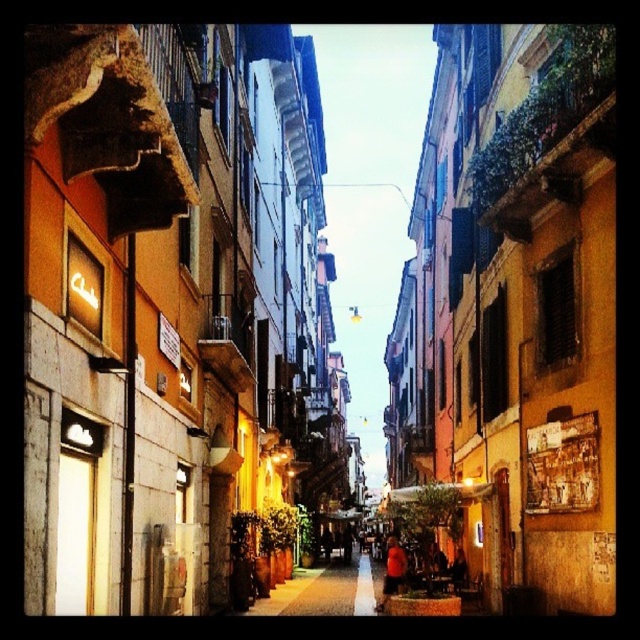
Question: Among these objects, which one is farthest from the camera?

Choices:
 (A) orange fabric shirt at lower center
 (B) brown stone planter at center

Answer: (A)

Question: In this image, where is brown stone planter at center located relative to orange fabric shirt at lower center?

Choices:
 (A) right
 (B) left

Answer: (B)

Question: Which object appears farthest from the camera in this image?

Choices:
 (A) brown stone planter at center
 (B) orange fabric shirt at lower center

Answer: (B)

Question: Which object appears closest to the camera in this image?

Choices:
 (A) brown stone planter at center
 (B) orange fabric shirt at lower center

Answer: (A)

Question: Can you confirm if brown stone planter at center is positioned to the right of orange fabric shirt at lower center?

Choices:
 (A) yes
 (B) no

Answer: (B)

Question: Does brown stone planter at center have a greater width compared to orange fabric shirt at lower center?

Choices:
 (A) yes
 (B) no

Answer: (A)